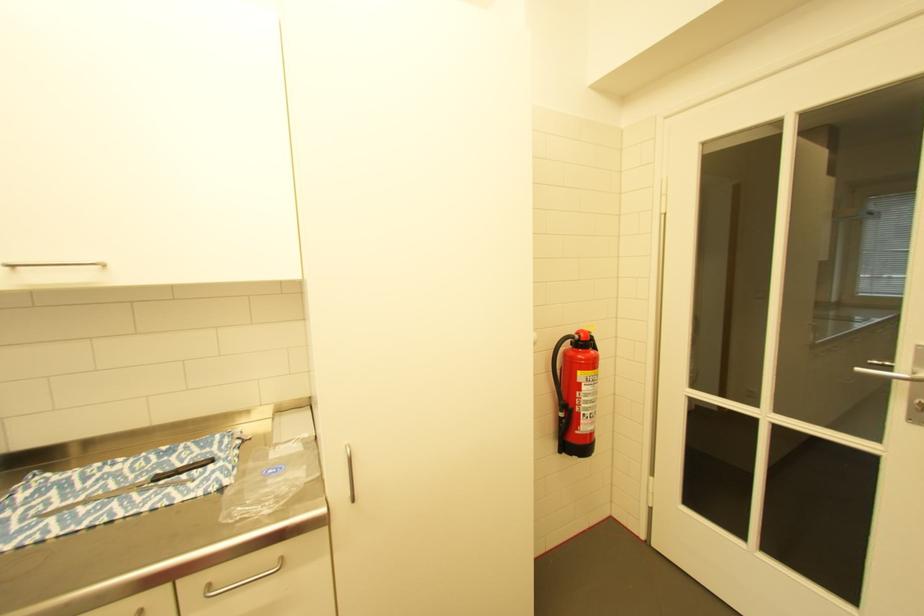
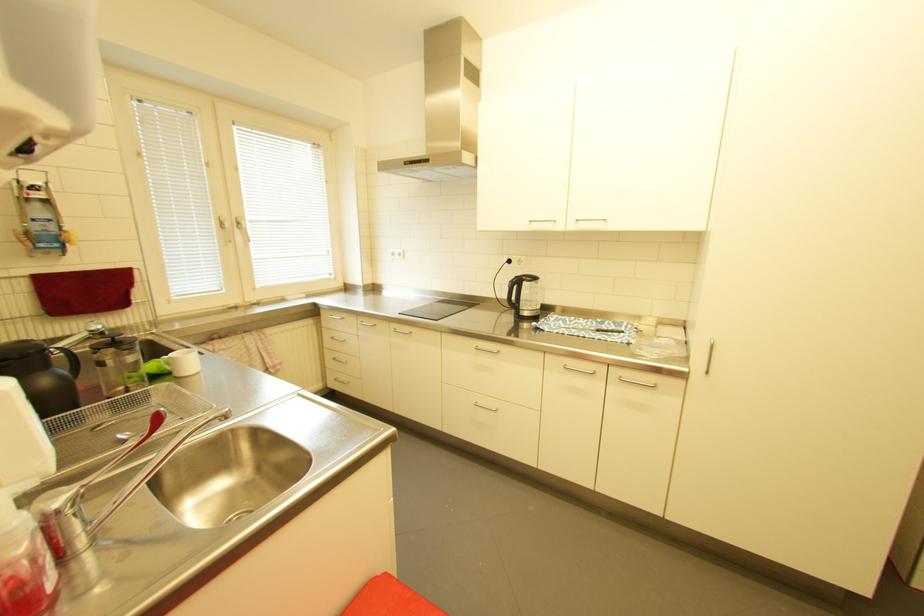
Question: Based on the continuous images, in which direction is the camera rotating? Reply with the corresponding letter.

Choices:
 (A) Left
 (B) Right
 (C) Up
 (D) Down

Answer: (A)